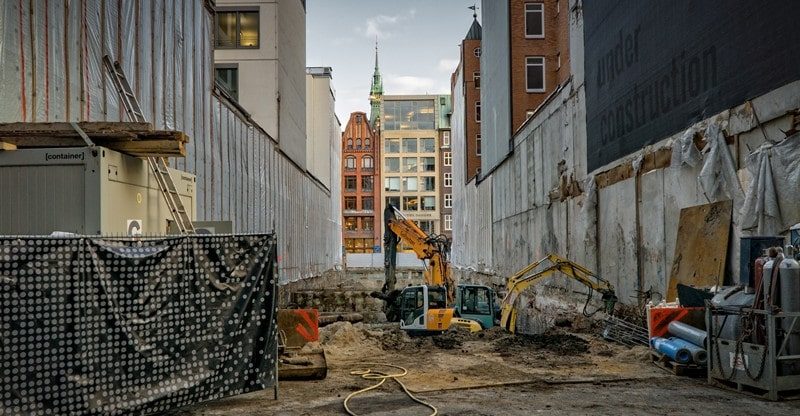
Where is `ladder`? ladder is located at coordinates (121, 90).